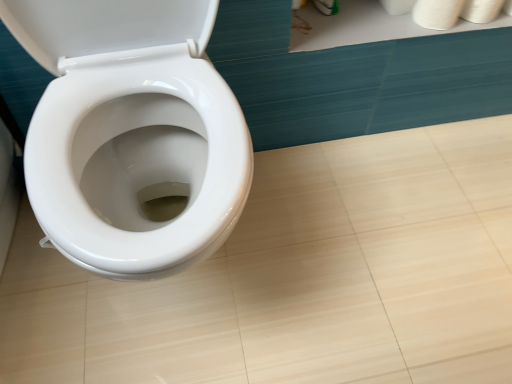
Locate an element on the screen. vacant space positioned to the left of white matte toilet paper at upper right, marked as the second toilet paper in a right-to-left arrangement is located at coordinates (377, 23).